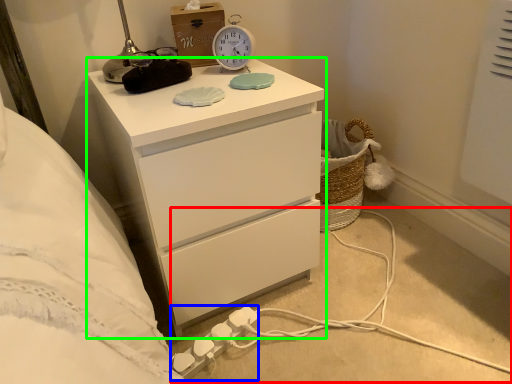
Question: Based on their relative distances, which object is farther from cable (highlighted by a red box)? Choose from extension cord (highlighted by a blue box) and chest of drawers (highlighted by a green box).

Choices:
 (A) extension cord
 (B) chest of drawers

Answer: (B)